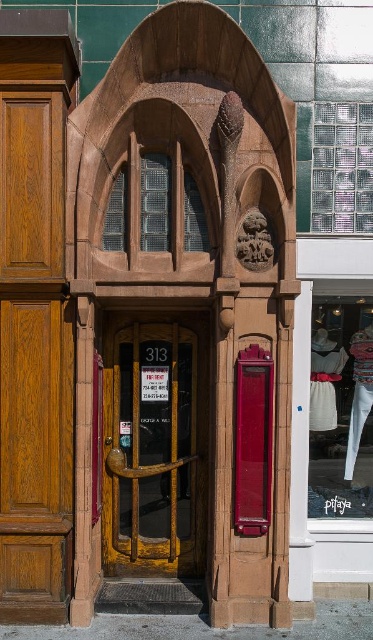
You are a delivery person trying to place a package on the ground near the yellow matte door at center without blocking the white fabric at lower right. The package is 12 inches wide. Can you safely place it between them?

The yellow matte door at center and white fabric at lower right are 37.81 inches apart. Since the package is only 12 inches wide, there is enough space between them to place it without blocking the white fabric at lower right.